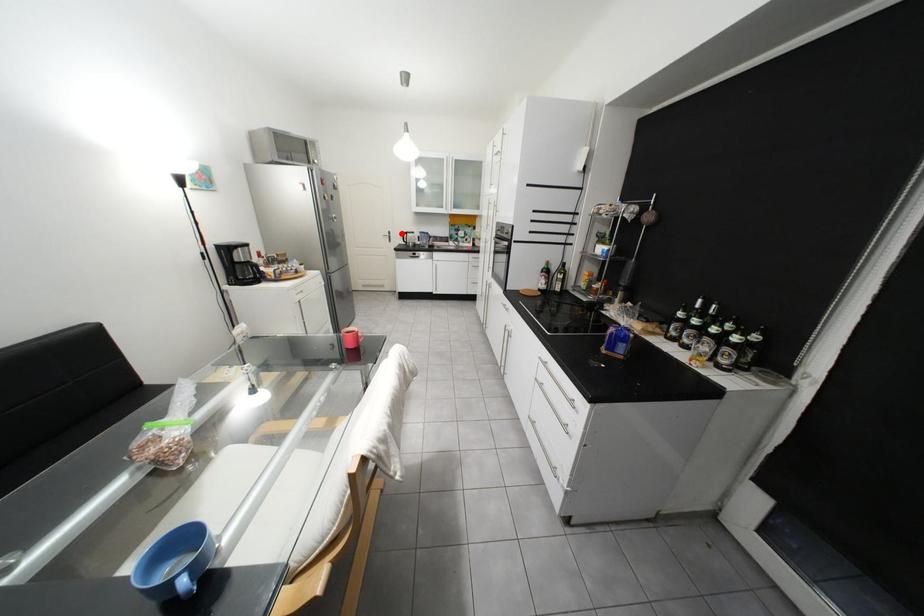
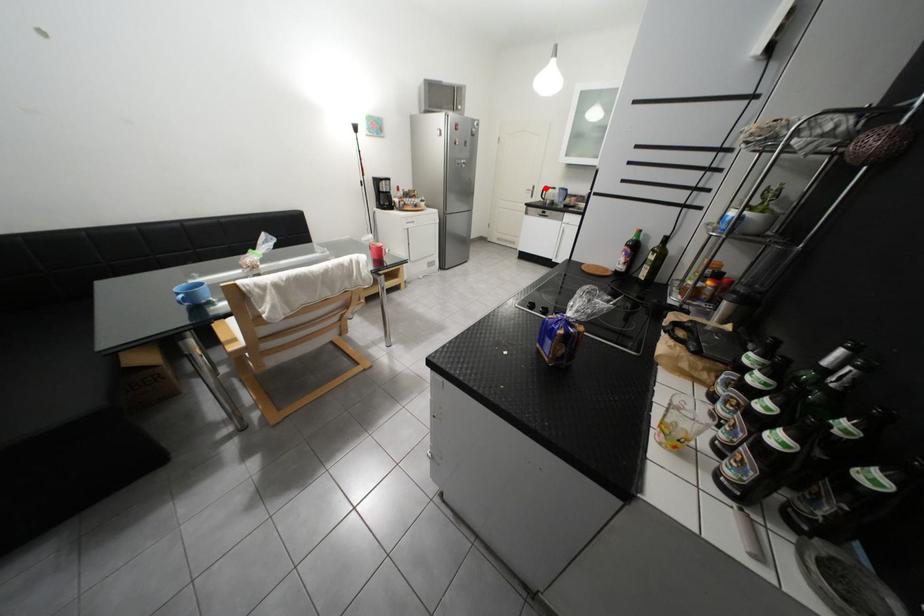
Based on the photo, I am providing you with two images of the same scene from different viewpoints. A red point is marked on the first image and another point is marked on the second image. Is the red point in image1 aligned with the point shown in image2?

Yes